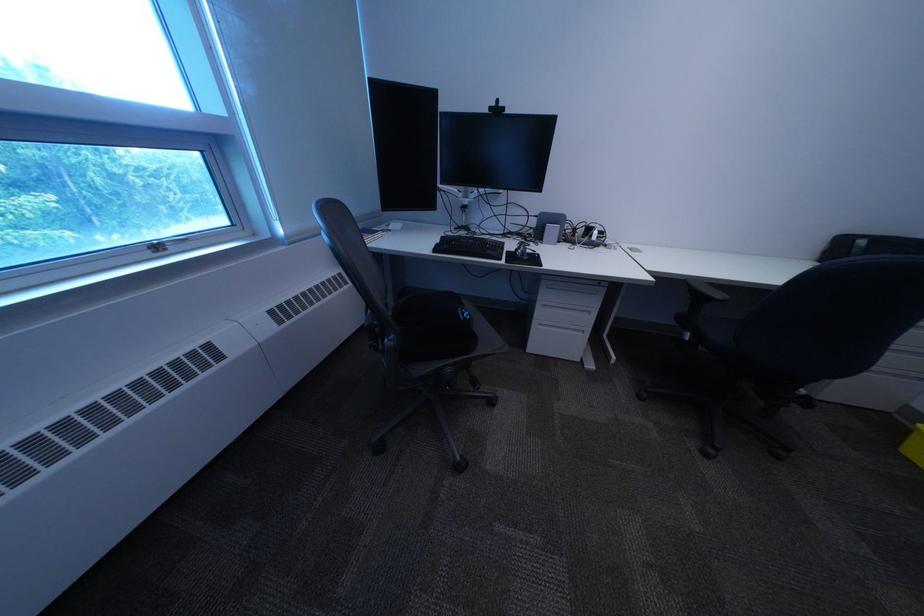
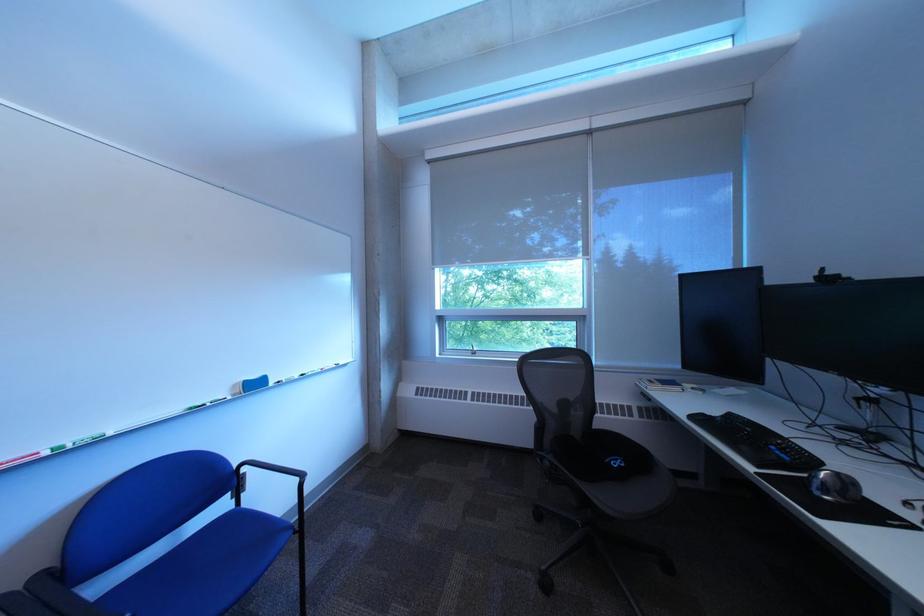
Where in the second image is the point corresponding to point (465, 371) from the first image?

(563, 464)